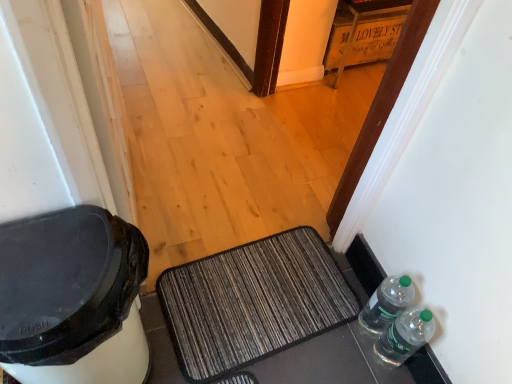
Where is `free space behind clear plastic bottles at lower right, which ranks as the first bottle in back-to-front order`? free space behind clear plastic bottles at lower right, which ranks as the first bottle in back-to-front order is located at coordinates (339, 278).